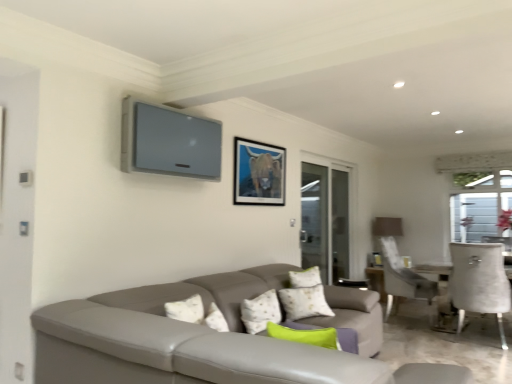
Question: From a real-world perspective, is matte black picture frame at upper center beneath green fabric pillow at center?

Choices:
 (A) yes
 (B) no

Answer: (B)

Question: Is matte black picture frame at upper center smaller than green fabric pillow at center?

Choices:
 (A) no
 (B) yes

Answer: (B)

Question: Considering the relative positions of matte black picture frame at upper center and green fabric pillow at center in the image provided, is matte black picture frame at upper center to the right of green fabric pillow at center from the viewer's perspective?

Choices:
 (A) no
 (B) yes

Answer: (B)

Question: Can you confirm if matte black picture frame at upper center is bigger than green fabric pillow at center?

Choices:
 (A) yes
 (B) no

Answer: (B)

Question: From a real-world perspective, is matte black picture frame at upper center on top of green fabric pillow at center?

Choices:
 (A) no
 (B) yes

Answer: (B)

Question: Is matte black picture frame at upper center taller than green fabric pillow at center?

Choices:
 (A) no
 (B) yes

Answer: (B)

Question: Is the position of green fabric pillow at center less distant than that of transparent glass screen door at right?

Choices:
 (A) yes
 (B) no

Answer: (A)

Question: Can you confirm if green fabric pillow at center is positioned to the right of transparent glass screen door at right?

Choices:
 (A) yes
 (B) no

Answer: (B)

Question: Is green fabric pillow at center surrounding transparent glass screen door at right?

Choices:
 (A) no
 (B) yes

Answer: (A)

Question: From the image's perspective, is green fabric pillow at center located above transparent glass screen door at right?

Choices:
 (A) no
 (B) yes

Answer: (A)

Question: Considering the relative sizes of green fabric pillow at center and transparent glass screen door at right in the image provided, is green fabric pillow at center shorter than transparent glass screen door at right?

Choices:
 (A) yes
 (B) no

Answer: (A)

Question: Does green fabric pillow at center have a larger size compared to transparent glass screen door at right?

Choices:
 (A) no
 (B) yes

Answer: (A)

Question: Does transparent glass screen door at right have a greater height compared to matte black picture frame at upper center?

Choices:
 (A) yes
 (B) no

Answer: (A)